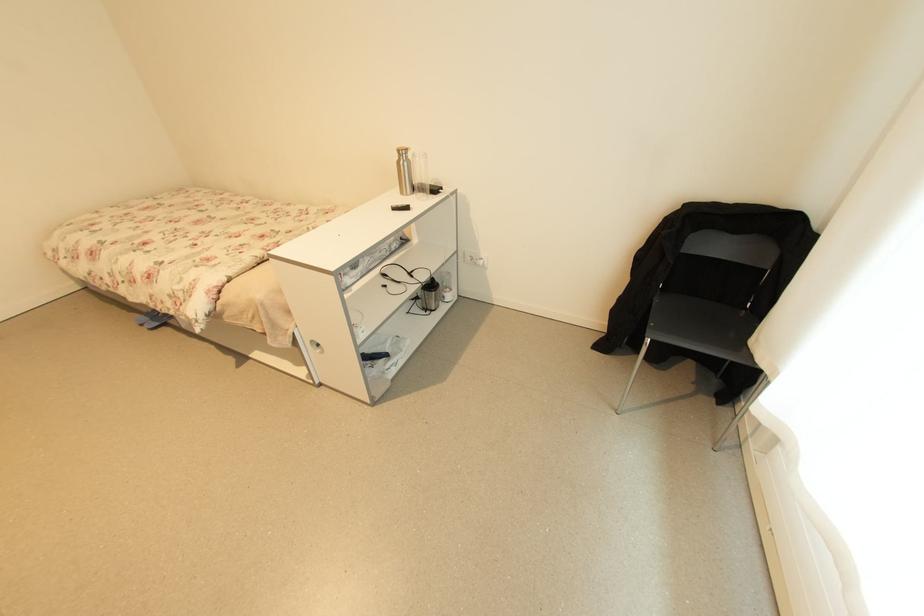
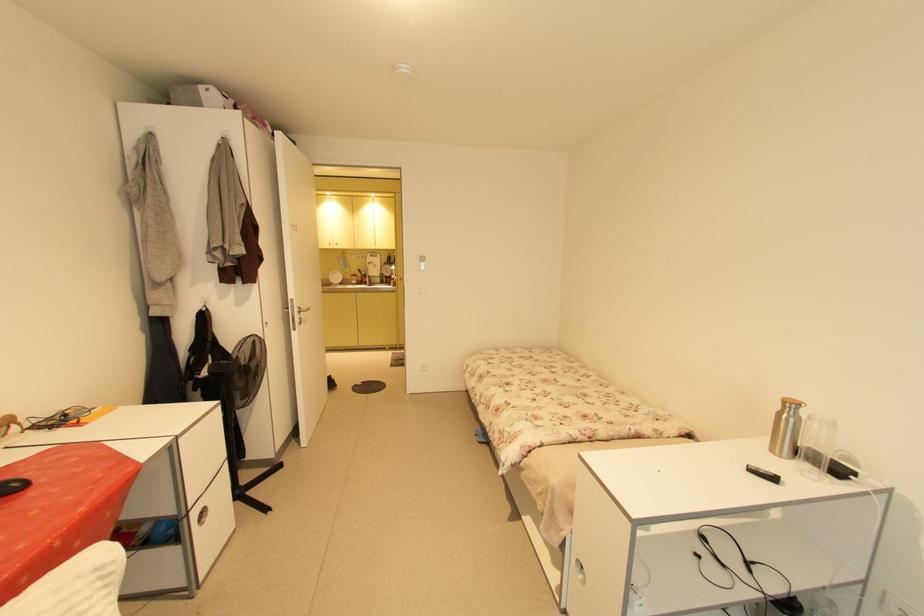
Question: The images are taken continuously from a first-person perspective. In which direction is your viewpoint rotating?

Choices:
 (A) Left
 (B) Right
 (C) Up
 (D) Down

Answer: (A)